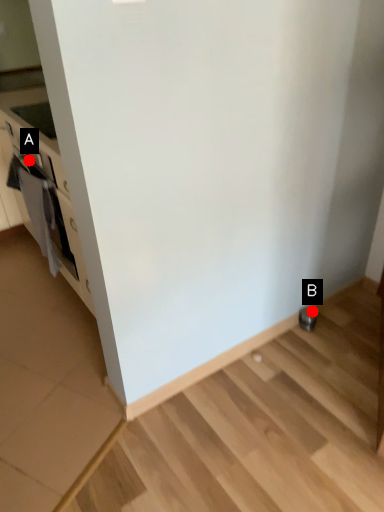
Question: Two points are circled on the image, labeled by A and B beside each circle. Which point is farther from the camera taking this photo?

Choices:
 (A) A is further
 (B) B is further

Answer: (B)